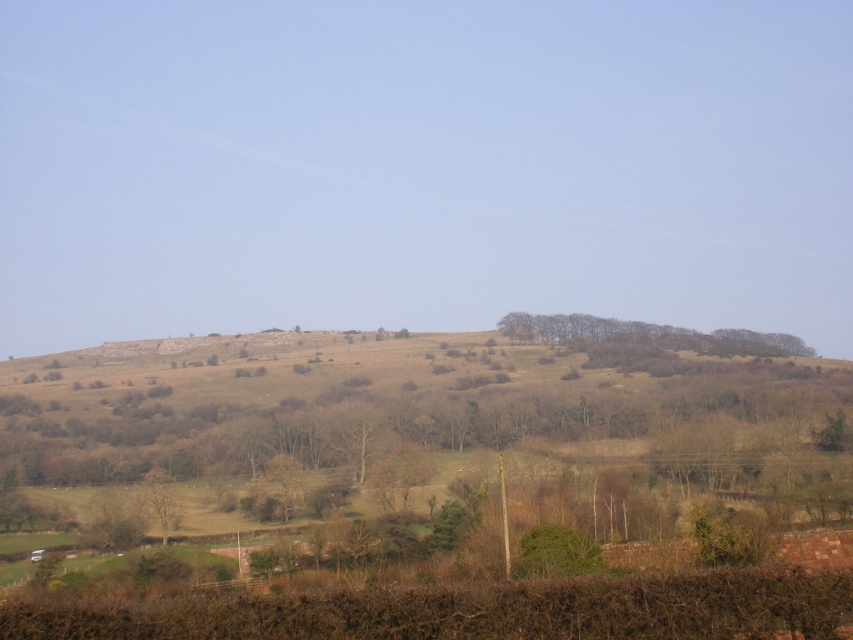
You are an artist planning to sketch the scene. You want to ensure the size of the brown textured trees at center and the brown textured tree at lower left are proportionate. Which one should you draw larger?

The brown textured trees at center should be drawn larger than the brown textured tree at lower left because the description states that brown textured trees at center is bigger than brown textured tree at lower left.

You are standing at the point closest to the bottom of the image and want to walk towards the horizon. Which point, point [515,337] or point [165,538], is closer to your starting position?

Point [165,538] is closer to your starting position because it is in front of point [515,337].

You are standing in the rural landscape and notice two trees. One is the brown textured trees at center and the other is the brown textured tree at lower left. Which tree is positioned higher up in the scene?

The brown textured trees at center is located above the brown textured tree at lower left, so it is positioned higher up in the scene.